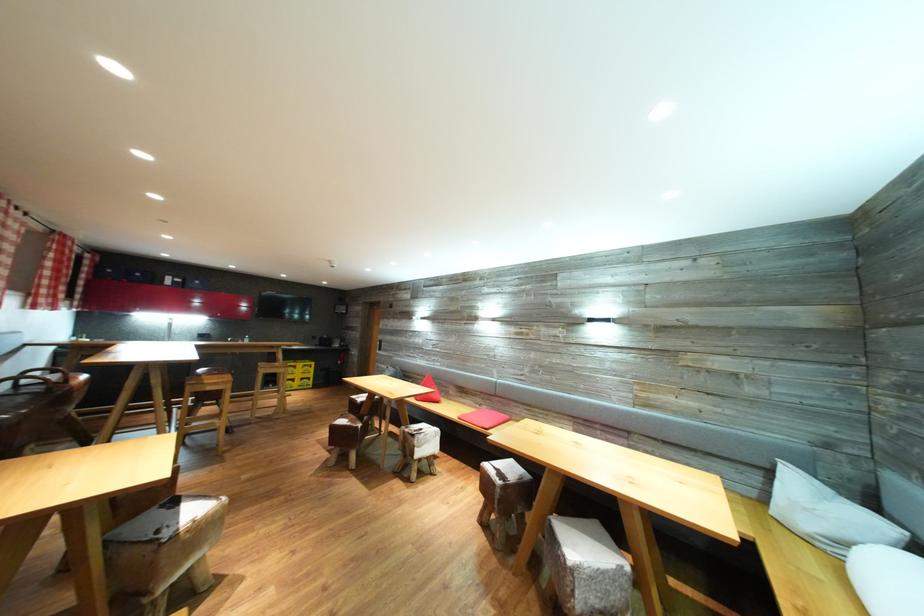
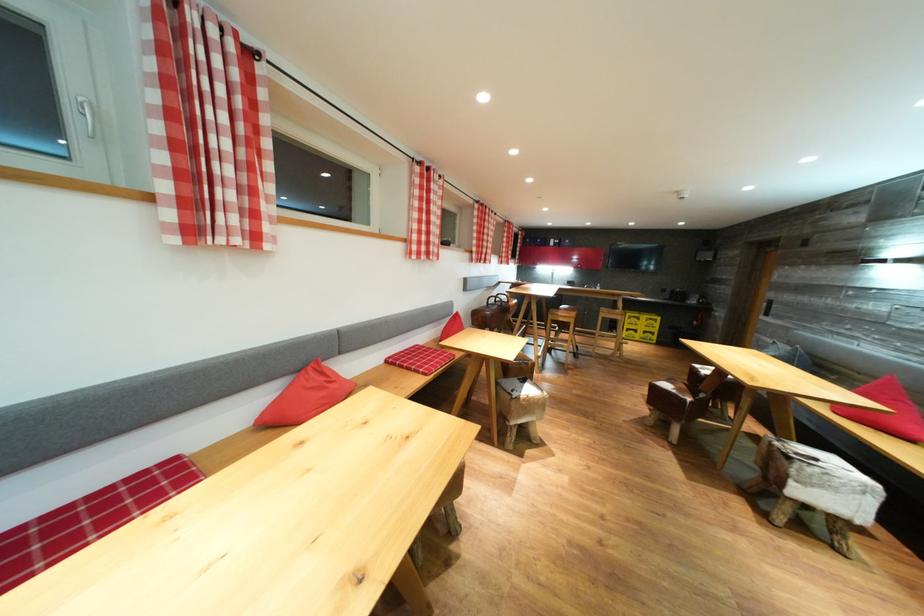
The point at (216, 394) is marked in the first image. Where is the corresponding point in the second image?

(567, 325)